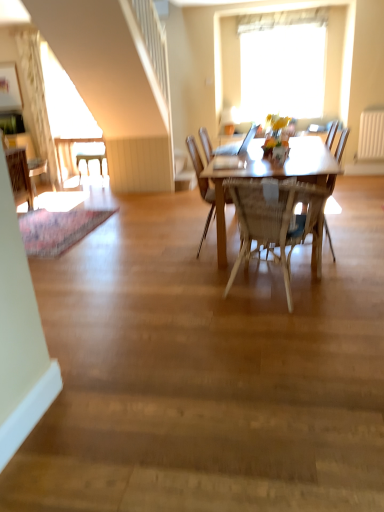
This screenshot has width=384, height=512. In order to click on free location to the left of matte white vase at center in this screenshot , I will do `click(267, 163)`.